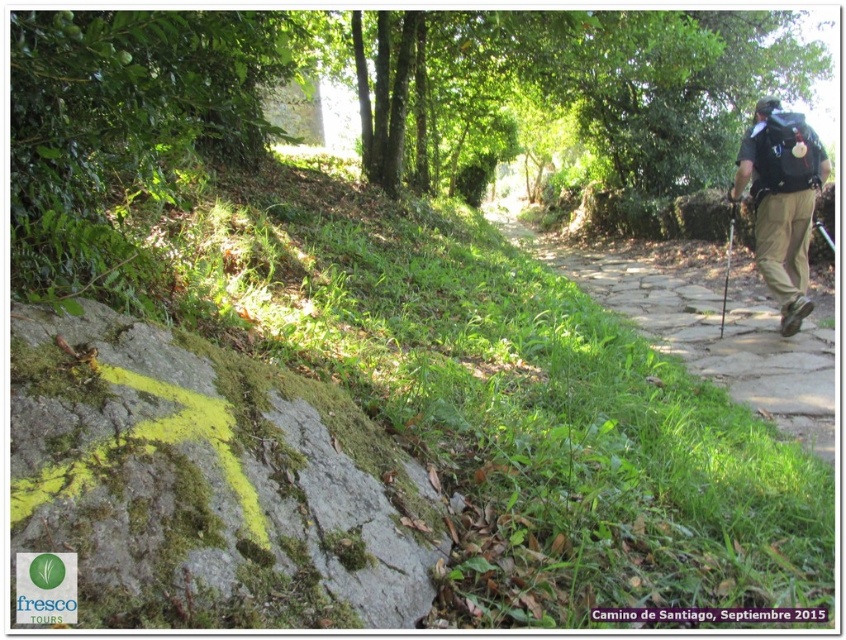
You are a hiker standing on the Camino de Santiago trail. You see a green mossy rock at lower left and a dark gray backpack at right. Which object is positioned lower in the image?

The green mossy rock at lower left is positioned below the dark gray backpack at right, so it is lower in the image.

You are a hiker carrying a dark gray backpack at right and want to walk along the brown stone path at right. Can your backpack fit through the path without needing to turn sideways?

The brown stone path at right is wider than the dark gray backpack at right, so the backpack can fit through the path without needing to turn sideways.